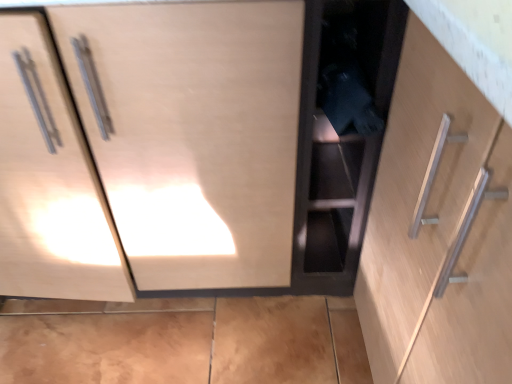
Locate an element on the screen. This screenshot has width=512, height=384. black matte cabinet at center, which is the 1th cabinetry from right to left is located at coordinates (339, 146).

Describe the element at coordinates (339, 146) in the screenshot. I see `black matte cabinet at center, which is the 1th cabinetry from right to left` at that location.

How much space does black matte cabinet at center, which is the second cabinetry from left to right, occupy horizontally?

It is 13.37 inches.

Image resolution: width=512 pixels, height=384 pixels. I want to click on matte wood cabinet at center, which appears as the second cabinetry when viewed from the right, so click(x=159, y=148).

What do you see at coordinates (159, 148) in the screenshot? I see `matte wood cabinet at center, which appears as the second cabinetry when viewed from the right` at bounding box center [159, 148].

In order to click on black matte cabinet at center, which is the 1th cabinetry from right to left in this screenshot , I will do (339, 146).

Which object is positioned more to the left, matte wood cabinet at center, which appears as the second cabinetry when viewed from the right, or black matte cabinet at center, which is the 1th cabinetry from right to left?

From the viewer's perspective, matte wood cabinet at center, which appears as the second cabinetry when viewed from the right, appears more on the left side.

Is matte wood cabinet at center, which appears as the second cabinetry when viewed from the right, positioned behind black matte cabinet at center, which is the 1th cabinetry from right to left?

That is False.

Is point (168, 135) less distant than point (378, 73)?

No, (168, 135) is behind (378, 73).

From the image's perspective, between matte wood cabinet at center, which appears as the second cabinetry when viewed from the right, and black matte cabinet at center, which is the 1th cabinetry from right to left, who is located below?

From the image's view, black matte cabinet at center, which is the 1th cabinetry from right to left, is below.

From a real-world perspective, is matte wood cabinet at center, which appears as the second cabinetry when viewed from the right, above or below black matte cabinet at center, which is the 1th cabinetry from right to left?

Clearly, from a real-world perspective, matte wood cabinet at center, which appears as the second cabinetry when viewed from the right, is above black matte cabinet at center, which is the 1th cabinetry from right to left.

Considering the relative sizes of matte wood cabinet at center, which appears as the second cabinetry when viewed from the right, and black matte cabinet at center, which is the 1th cabinetry from right to left, in the image provided, is matte wood cabinet at center, which appears as the second cabinetry when viewed from the right, thinner than black matte cabinet at center, which is the 1th cabinetry from right to left,?

No, matte wood cabinet at center, which appears as the second cabinetry when viewed from the right, is not thinner than black matte cabinet at center, which is the 1th cabinetry from right to left.

Between matte wood cabinet at center, which appears as the second cabinetry when viewed from the right, and black matte cabinet at center, which is the 1th cabinetry from right to left, which one has more height?

Standing taller between the two is matte wood cabinet at center, which appears as the second cabinetry when viewed from the right.

Can you confirm if matte wood cabinet at center, the 1th cabinetry when ordered from left to right, is bigger than black matte cabinet at center, which is the 1th cabinetry from right to left?

Yes, matte wood cabinet at center, the 1th cabinetry when ordered from left to right, is bigger than black matte cabinet at center, which is the 1th cabinetry from right to left.

Is black matte cabinet at center, which is the 1th cabinetry from right to left, inside matte wood cabinet at center, which appears as the second cabinetry when viewed from the right?

Actually, black matte cabinet at center, which is the 1th cabinetry from right to left, is outside matte wood cabinet at center, which appears as the second cabinetry when viewed from the right.

Are matte wood cabinet at center, which appears as the second cabinetry when viewed from the right, and black matte cabinet at center, which is the second cabinetry from left to right, beside each other?

No, matte wood cabinet at center, which appears as the second cabinetry when viewed from the right, is not in contact with black matte cabinet at center, which is the second cabinetry from left to right.

Is matte wood cabinet at center, the 1th cabinetry when ordered from left to right, facing away from black matte cabinet at center, which is the second cabinetry from left to right?

No, matte wood cabinet at center, the 1th cabinetry when ordered from left to right,'s orientation is not away from black matte cabinet at center, which is the second cabinetry from left to right.

What's the angular difference between matte wood cabinet at center, which appears as the second cabinetry when viewed from the right, and black matte cabinet at center, which is the 1th cabinetry from right to left,'s facing directions?

1.38e-05 degrees.

Locate an element on the screen. This screenshot has height=384, width=512. cabinetry above the black matte cabinet at center, which is the 1th cabinetry from right to left (from the image's perspective) is located at coordinates (159, 148).

Is black matte cabinet at center, which is the 1th cabinetry from right to left, to the left of matte wood cabinet at center, which appears as the second cabinetry when viewed from the right, from the viewer's perspective?

In fact, black matte cabinet at center, which is the 1th cabinetry from right to left, is to the right of matte wood cabinet at center, which appears as the second cabinetry when viewed from the right.

Is black matte cabinet at center, which is the second cabinetry from left to right, positioned in front of matte wood cabinet at center, the 1th cabinetry when ordered from left to right?

That is False.

Which point is more forward, [314,144] or [291,221]?

The point [291,221] is closer to the camera.

From the image's perspective, is black matte cabinet at center, which is the second cabinetry from left to right, over matte wood cabinet at center, which appears as the second cabinetry when viewed from the right?

No, from the image's perspective, black matte cabinet at center, which is the second cabinetry from left to right, is not above matte wood cabinet at center, which appears as the second cabinetry when viewed from the right.

In the scene shown: From a real-world perspective, which object stands above the other?

In real-world perspective, matte wood cabinet at center, the 1th cabinetry when ordered from left to right, is above.

Which of these two, black matte cabinet at center, which is the 1th cabinetry from right to left, or matte wood cabinet at center, the 1th cabinetry when ordered from left to right, is wider?

Wider between the two is matte wood cabinet at center, the 1th cabinetry when ordered from left to right.

Is black matte cabinet at center, which is the 1th cabinetry from right to left, shorter than matte wood cabinet at center, which appears as the second cabinetry when viewed from the right?

Yes.

Who is smaller, black matte cabinet at center, which is the second cabinetry from left to right, or matte wood cabinet at center, the 1th cabinetry when ordered from left to right?

With smaller size is black matte cabinet at center, which is the second cabinetry from left to right.

Is black matte cabinet at center, which is the second cabinetry from left to right, not within matte wood cabinet at center, which appears as the second cabinetry when viewed from the right?

Yes, black matte cabinet at center, which is the second cabinetry from left to right, is not within matte wood cabinet at center, which appears as the second cabinetry when viewed from the right.

Are black matte cabinet at center, which is the second cabinetry from left to right, and matte wood cabinet at center, the 1th cabinetry when ordered from left to right, beside each other?

They are not placed beside each other.

Is black matte cabinet at center, which is the second cabinetry from left to right, positioned with its back to matte wood cabinet at center, the 1th cabinetry when ordered from left to right?

black matte cabinet at center, which is the second cabinetry from left to right, does not have its back to matte wood cabinet at center, the 1th cabinetry when ordered from left to right.

Measure the distance from black matte cabinet at center, which is the 1th cabinetry from right to left, to matte wood cabinet at center, which appears as the second cabinetry when viewed from the right.

black matte cabinet at center, which is the 1th cabinetry from right to left, is 9.81 inches away from matte wood cabinet at center, which appears as the second cabinetry when viewed from the right.

Locate an element on the screen. The image size is (512, 384). cabinetry located below the matte wood cabinet at center, which appears as the second cabinetry when viewed from the right (from the image's perspective) is located at coordinates (339, 146).

The width and height of the screenshot is (512, 384). In order to click on cabinetry located behind the matte wood cabinet at center, which appears as the second cabinetry when viewed from the right in this screenshot , I will do `click(339, 146)`.

The image size is (512, 384). I want to click on cabinetry in front of the black matte cabinet at center, which is the 1th cabinetry from right to left, so click(x=159, y=148).